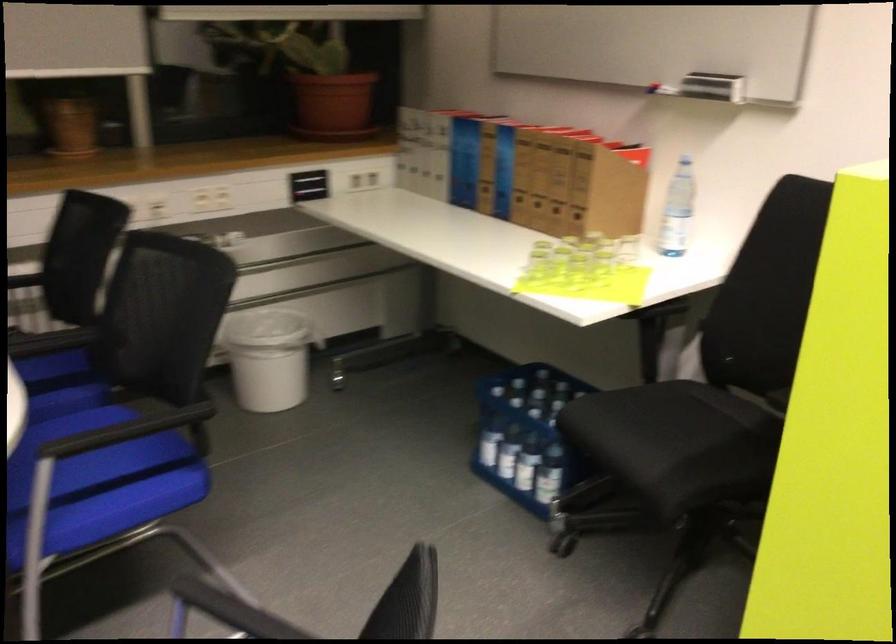
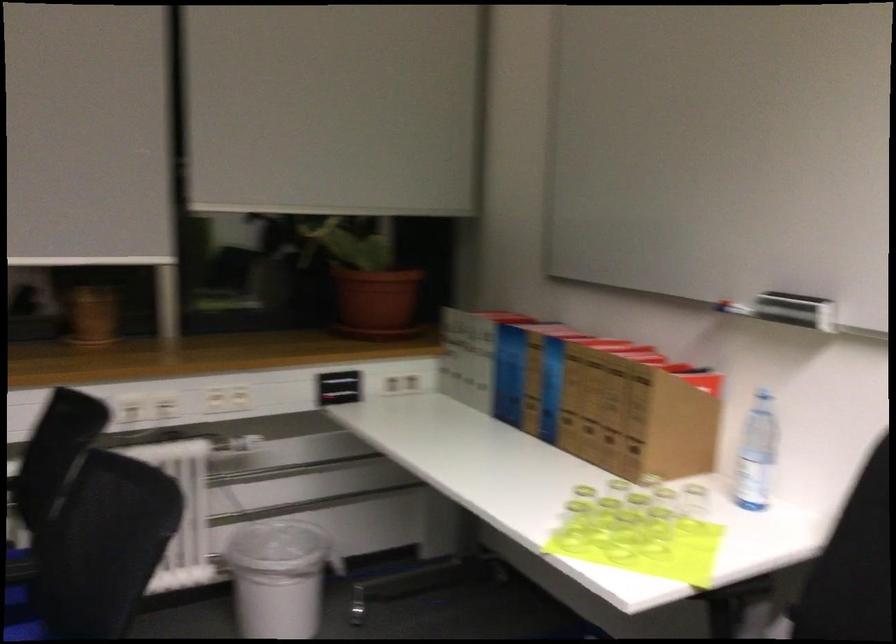
In the second image, find the point that corresponds to pixel 78 372 in the first image.

(23, 603)